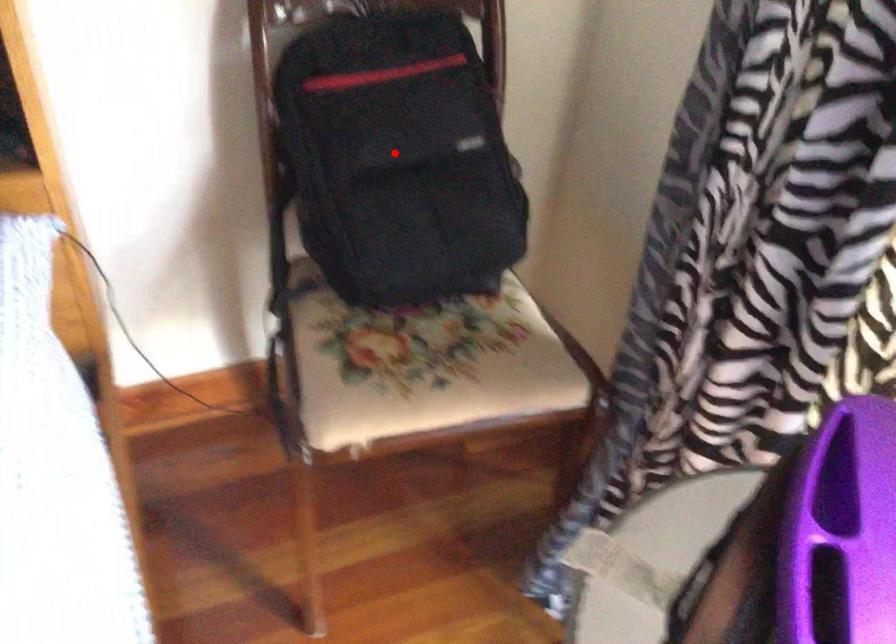
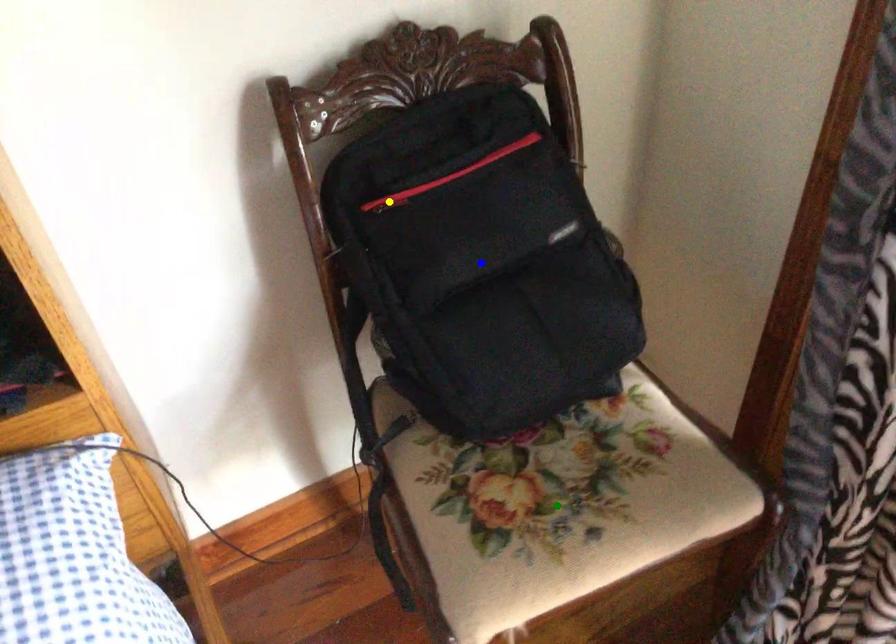
Question: I am providing you with two images of the same scene from different viewpoints. A red point is marked on the first image. You are given multiple points on the second image. Can you choose the point in image 2 that corresponds to the point in image 1?

Choices:
 (A) yellow point
 (B) blue point
 (C) green point

Answer: (B)